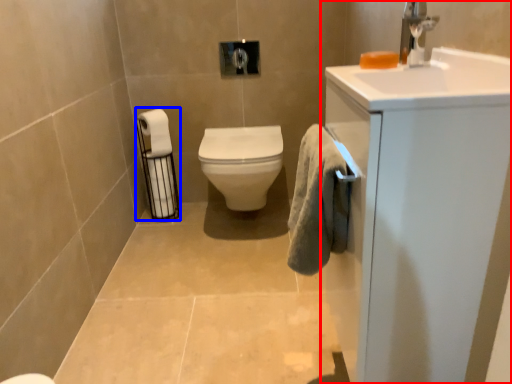
Question: Which object is further to the camera taking this photo, bathroom cabinet (highlighted by a red box) or toilet paper (highlighted by a blue box)?

Choices:
 (A) bathroom cabinet
 (B) toilet paper

Answer: (B)